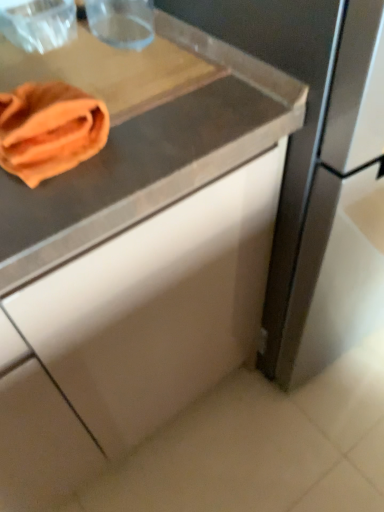
In order to face orange cloth at upper left, should I rotate leftwards or rightwards?

Turn left approximately 15.654 degrees to face it.

What do you see at coordinates (112, 72) in the screenshot? The image size is (384, 512). I see `orange cloth at upper left` at bounding box center [112, 72].

Measure the distance between point (124, 102) and camera.

They are 24.61 inches apart.

Find the location of a particular element. This screenshot has height=512, width=384. orange cloth at upper left is located at coordinates (112, 72).

The height and width of the screenshot is (512, 384). What do you see at coordinates (49, 130) in the screenshot?
I see `orange microfiber cloth at upper left` at bounding box center [49, 130].

What is the approximate width of orange microfiber cloth at upper left?

orange microfiber cloth at upper left is 8.11 inches in width.

What are the coordinates of `orange microfiber cloth at upper left` in the screenshot? It's located at (49, 130).

Find the location of a particular element. The width and height of the screenshot is (384, 512). orange cloth at upper left is located at coordinates (112, 72).

Which is more to the right, orange microfiber cloth at upper left or orange cloth at upper left?

orange cloth at upper left.

Between orange microfiber cloth at upper left and orange cloth at upper left, which one is positioned behind?

orange cloth at upper left is further from the camera.

Which is behind, point (62, 82) or point (130, 77)?

Point (130, 77)

From the image's perspective, which one is positioned lower, orange microfiber cloth at upper left or orange cloth at upper left?

orange microfiber cloth at upper left, from the image's perspective.

From a real-world perspective, who is located higher, orange microfiber cloth at upper left or orange cloth at upper left?

orange microfiber cloth at upper left.

Considering the sizes of orange microfiber cloth at upper left and orange cloth at upper left in the image, is orange microfiber cloth at upper left wider or thinner than orange cloth at upper left?

Considering their sizes, orange microfiber cloth at upper left looks slimmer than orange cloth at upper left.

Can you confirm if orange microfiber cloth at upper left is taller than orange cloth at upper left?

Yes.

Considering the relative sizes of orange microfiber cloth at upper left and orange cloth at upper left in the image provided, is orange microfiber cloth at upper left smaller than orange cloth at upper left?

Yes.

Is orange microfiber cloth at upper left inside the boundaries of orange cloth at upper left, or outside?

orange microfiber cloth at upper left is spatially situated outside orange cloth at upper left.

Is orange microfiber cloth at upper left placed right next to orange cloth at upper left?

No, orange microfiber cloth at upper left is not next to orange cloth at upper left.

Is orange microfiber cloth at upper left oriented away from orange cloth at upper left?

That's not correct — orange microfiber cloth at upper left is not looking away from orange cloth at upper left.

How many degrees apart are the facing directions of orange microfiber cloth at upper left and orange cloth at upper left?

The angular difference between orange microfiber cloth at upper left and orange cloth at upper left is 0.000376 degrees.

This screenshot has width=384, height=512. Find the location of `material in front of the orange cloth at upper left`. material in front of the orange cloth at upper left is located at coordinates (49, 130).

Which object is positioned more to the right, orange cloth at upper left or orange microfiber cloth at upper left?

From the viewer's perspective, orange cloth at upper left appears more on the right side.

In the image, is orange cloth at upper left positioned in front of or behind orange microfiber cloth at upper left?

Visually, orange cloth at upper left is located behind orange microfiber cloth at upper left.

Is point (130, 106) behind point (99, 128)?

That is True.

From the image's perspective, is orange cloth at upper left under orange microfiber cloth at upper left?

No, from the image's perspective, orange cloth at upper left is not beneath orange microfiber cloth at upper left.

From a real-world perspective, who is located lower, orange cloth at upper left or orange microfiber cloth at upper left?

From a 3D spatial view, orange cloth at upper left is below.

Which of these two, orange cloth at upper left or orange microfiber cloth at upper left, is thinner?

→ orange microfiber cloth at upper left.

Considering the sizes of objects orange cloth at upper left and orange microfiber cloth at upper left in the image provided, who is shorter, orange cloth at upper left or orange microfiber cloth at upper left?

Standing shorter between the two is orange cloth at upper left.

Looking at the image, does orange cloth at upper left seem bigger or smaller compared to orange microfiber cloth at upper left?

Considering their sizes, orange cloth at upper left takes up more space than orange microfiber cloth at upper left.

Could orange microfiber cloth at upper left be considered to be inside orange cloth at upper left?

No, orange microfiber cloth at upper left is not a part of orange cloth at upper left.

Is orange cloth at upper left placed right next to orange microfiber cloth at upper left?

No, orange cloth at upper left is not beside orange microfiber cloth at upper left.

Is orange cloth at upper left oriented towards orange microfiber cloth at upper left?

No, orange cloth at upper left is not aimed at orange microfiber cloth at upper left.

Image resolution: width=384 pixels, height=512 pixels. In order to click on material located in front of the orange cloth at upper left in this screenshot , I will do click(49, 130).

This screenshot has width=384, height=512. Identify the location of material that appears on the left of orange cloth at upper left. (49, 130).

In the image, there is a orange cloth at upper left. Where is `material below it (from the image's perspective)`? material below it (from the image's perspective) is located at coordinates (49, 130).